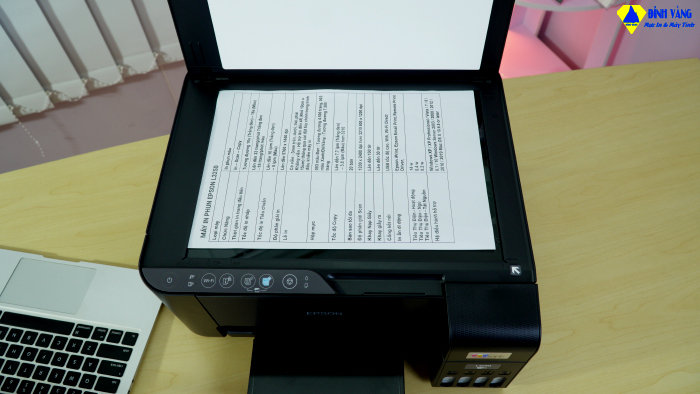
At what (x,y) coordinates should I click in order to perform the action: click on printer. Please return your answer as a coordinate pair (x, y). The image size is (700, 394). Looking at the image, I should click on (510, 255).